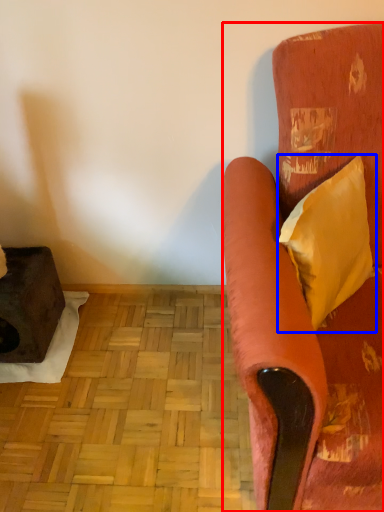
Question: Among these objects, which one is farthest to the camera, studio couch (highlighted by a red box) or pillow (highlighted by a blue box)?

Choices:
 (A) studio couch
 (B) pillow

Answer: (B)